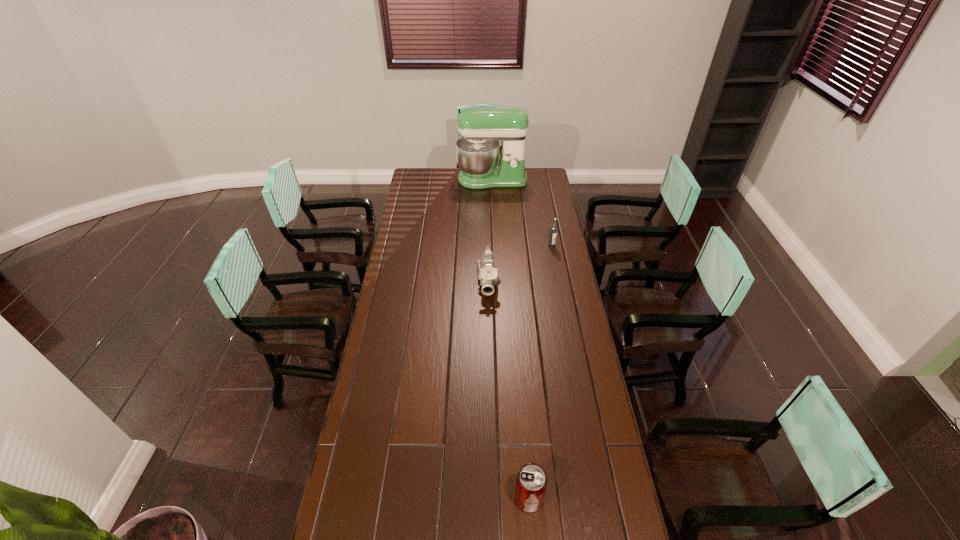
This screenshot has height=540, width=960. Identify the location of unoccupied area between the third farthest object and the nearest object. (509, 389).

The width and height of the screenshot is (960, 540). I want to click on vacant space that's between the third farthest object and the nearest object, so click(509, 389).

Locate an element on the screen. The height and width of the screenshot is (540, 960). vacant space in between the mixer and the third farthest object is located at coordinates (491, 230).

Identify the location of vacant area between the pop soda and the camcorder. (509, 389).

Identify which object is the third nearest to the nearest object. Please provide its 2D coordinates. Your answer should be formatted as a tuple, i.e. [(x, y)], where the tuple contains the x and y coordinates of a point satisfying the conditions above.

[(477, 150)]

Locate which object ranks second in proximity to the mixer. Please provide its 2D coordinates. Your answer should be formatted as a tuple, i.e. [(x, y)], where the tuple contains the x and y coordinates of a point satisfying the conditions above.

[(487, 274)]

Find the location of a particular element. The width and height of the screenshot is (960, 540). free space that satisfies the following two spatial constraints: 1. on the front-facing side of the nearest object; 2. on the left side of the third farthest object is located at coordinates tap(493, 498).

The height and width of the screenshot is (540, 960). Identify the location of free location that satisfies the following two spatial constraints: 1. on the controls of the pop soda; 2. on the left side of the mixer. point(503,498).

Locate an element on the screen. This screenshot has width=960, height=540. blank space that satisfies the following two spatial constraints: 1. on the controls of the pop soda; 2. on the right side of the farthest object is located at coordinates (503, 498).